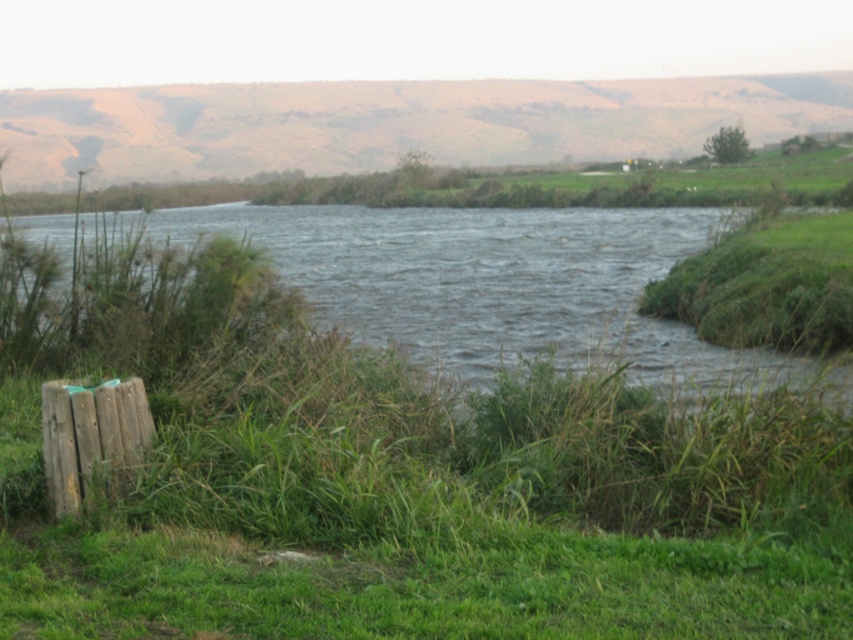
You are a hiker who wants to cross the river. You see the dark blue water at center and the wooden post at lower left. Which object is closer to your current position?

The wooden post at lower left is closer to your current position because it is located below the dark blue water at center.

You are standing at the wooden post near the bottom left corner of the image and want to reach the point marked as point (395, 260) and point (71, 428). Which point is closer to you?

Point (395, 260) is closer to you because it is further to the viewer than point (71, 428), meaning it is physically nearer in the scene.